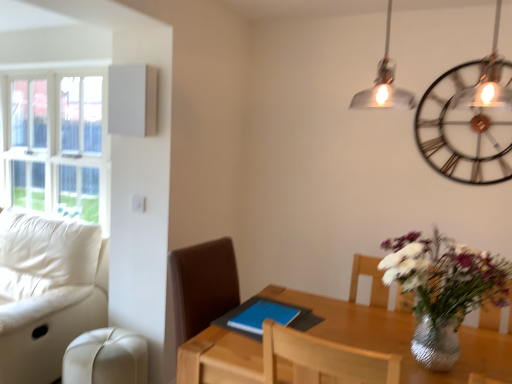
Where is `metallic/textured wall clock at upper right`? Image resolution: width=512 pixels, height=384 pixels. metallic/textured wall clock at upper right is located at coordinates (468, 122).

This screenshot has width=512, height=384. In order to click on beige leather swivel chair at lower left in this screenshot , I will do `click(106, 358)`.

In order to face white glass window at upper left, should I rotate leftwards or rightwards?

Turn left by 26.096 degrees to look at white glass window at upper left.

Based on the photo, measure the distance between white leather couch at left and camera.

7.09 feet.

The width and height of the screenshot is (512, 384). What are the coordinates of `wooden table at center` in the screenshot? It's located at (400, 337).

In terms of width, does metallic/textured wall clock at upper right look wider or thinner when compared to blue matte tablet at center?

In the image, metallic/textured wall clock at upper right appears to be more narrow than blue matte tablet at center.

From a real-world perspective, is metallic/textured wall clock at upper right on top of blue matte tablet at center?

Indeed, from a real-world perspective, metallic/textured wall clock at upper right stands above blue matte tablet at center.

Is metallic/textured wall clock at upper right aimed at blue matte tablet at center?

No, metallic/textured wall clock at upper right is not aimed at blue matte tablet at center.

Is metallic/textured wall clock at upper right inside or outside of white leather couch at left?

metallic/textured wall clock at upper right is not inside white leather couch at left, it's outside.

Is metallic/textured wall clock at upper right in contact with white leather couch at left?

metallic/textured wall clock at upper right and white leather couch at left are clearly separated.

In the scene shown: From the image's perspective, which one is positioned lower, metallic/textured wall clock at upper right or white leather couch at left?

white leather couch at left appears lower in the image.

Does point (236, 371) appear closer or farther from the camera than point (261, 311)?

Point (236, 371).

From the image's perspective, who appears lower, wooden table at center or blue matte tablet at center?

From the image's view, wooden table at center is below.

Is wooden table at center far from blue matte tablet at center?

wooden table at center is actually quite close to blue matte tablet at center.

The image size is (512, 384). Find the location of `tablet computer on the left of wooden table at center`. tablet computer on the left of wooden table at center is located at coordinates (263, 316).

Based on the photo, from a real-world perspective, is white leather couch at left physically below wooden table at center?

No.

Is point (104, 245) less distant than point (490, 346)?

No, it is not.

Where is `table that appears on the right of white leather couch at left`? table that appears on the right of white leather couch at left is located at coordinates (400, 337).

Is white leather couch at left oriented towards wooden table at center?

No.

From the image's perspective, which is below, white leather couch at left or white glass window at upper left?

white leather couch at left, from the image's perspective.

Which object is closer to the camera taking this photo, white leather couch at left or white glass window at upper left?

white leather couch at left is more forward.

Between white leather couch at left and white glass window at upper left, which one has less height?

white leather couch at left.

Consider the image. Is beige leather swivel chair at lower left not within wooden table at center?

beige leather swivel chair at lower left is positioned outside wooden table at center.

Locate an element on the screen. The width and height of the screenshot is (512, 384). table in front of the beige leather swivel chair at lower left is located at coordinates tap(400, 337).

Is beige leather swivel chair at lower left positioned far away from wooden table at center?

That's right, there is a large distance between beige leather swivel chair at lower left and wooden table at center.

Is white glass window at upper left facing away from white leather couch at left?

No, white glass window at upper left's orientation is not away from white leather couch at left.

Which object is positioned more to the right, white glass window at upper left or white leather couch at left?

Positioned to the right is white leather couch at left.

What's the angular difference between white glass window at upper left and white leather couch at left's facing directions?

The facing directions of white glass window at upper left and white leather couch at left are 0.808 degrees apart.

Locate an element on the screen. The height and width of the screenshot is (384, 512). wall clock positioned vertically above the blue matte tablet at center (from a real-world perspective) is located at coordinates (468, 122).

You are a GUI agent. You are given a task and a screenshot of the screen. Output one action in this format:
    pyautogui.click(x=<x>, y=<y>)
    Task: Click on the wall clock lying behind the white leather couch at left
    
    Given the screenshot: What is the action you would take?
    pyautogui.click(x=468, y=122)

Considering their positions, is beige leather swivel chair at lower left positioned closer to metallic/textured wall clock at upper right than blue matte tablet at center?

blue matte tablet at center is closer to metallic/textured wall clock at upper right.

When comparing their distances from white glass window at upper left, does white leather couch at left or blue matte tablet at center seem further?

Among the two, blue matte tablet at center is located further to white glass window at upper left.

Based on their spatial positions, is white leather couch at left or beige leather swivel chair at lower left further from white glass window at upper left?

beige leather swivel chair at lower left is further to white glass window at upper left.

When comparing their distances from beige leather swivel chair at lower left, does metallic/textured wall clock at upper right or blue matte tablet at center seem further?

metallic/textured wall clock at upper right is further to beige leather swivel chair at lower left.

From the image, which object appears to be farther from beige leather swivel chair at lower left, white glass window at upper left or blue matte tablet at center?

Among the two, white glass window at upper left is located further to beige leather swivel chair at lower left.

Which object lies nearer to the anchor point blue matte tablet at center, metallic/textured wall clock at upper right or beige leather swivel chair at lower left?

beige leather swivel chair at lower left.

Estimate the real-world distances between objects in this image. Which object is further from wooden table at center, metallic/textured wall clock at upper right or white glass window at upper left?

white glass window at upper left is further to wooden table at center.

Which object lies nearer to the anchor point blue matte tablet at center, beige leather swivel chair at lower left or metallic/textured wall clock at upper right?

beige leather swivel chair at lower left is positioned closer to the anchor blue matte tablet at center.

Where is `swivel chair between white leather couch at left and metallic/textured wall clock at upper right`? This screenshot has width=512, height=384. swivel chair between white leather couch at left and metallic/textured wall clock at upper right is located at coordinates (106, 358).

The width and height of the screenshot is (512, 384). Find the location of `swivel chair situated between white leather couch at left and blue matte tablet at center from left to right`. swivel chair situated between white leather couch at left and blue matte tablet at center from left to right is located at coordinates (106, 358).

Where is `studio couch between white glass window at upper left and beige leather swivel chair at lower left in the vertical direction`? The height and width of the screenshot is (384, 512). studio couch between white glass window at upper left and beige leather swivel chair at lower left in the vertical direction is located at coordinates (50, 296).

The height and width of the screenshot is (384, 512). What are the coordinates of `studio couch between white glass window at upper left and metallic/textured wall clock at upper right` in the screenshot? It's located at (50, 296).